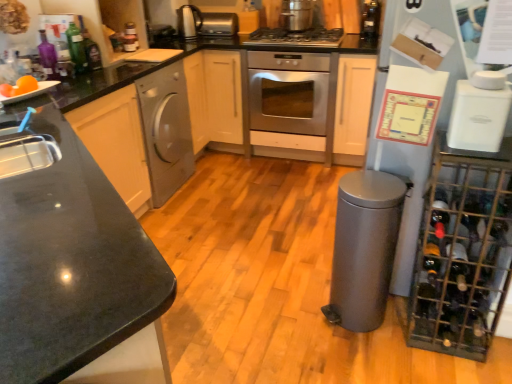
You are a GUI agent. You are given a task and a screenshot of the screen. Output one action in this format:
    pyautogui.click(x=<x>, y=<y>)
    Task: Click on the vacant position to the left of metallic wire wine rack at right
    This screenshot has height=384, width=512.
    Given the screenshot: What is the action you would take?
    pyautogui.click(x=377, y=351)